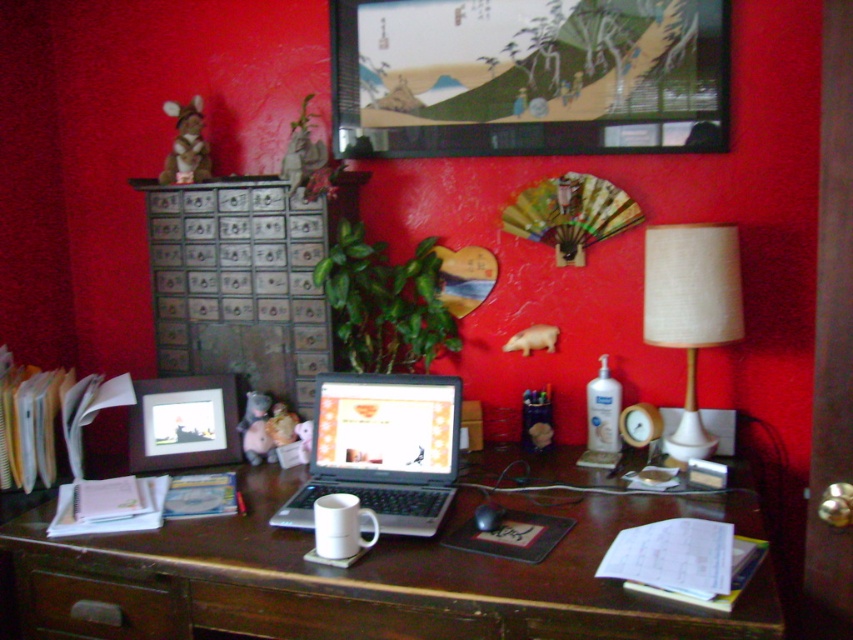
Consider the image. Is silver/black laptop at center to the right of brown wood drawer at lower left from the viewer's perspective?

Indeed, silver/black laptop at center is positioned on the right side of brown wood drawer at lower left.

Which is behind, point (419, 492) or point (33, 608)?

Positioned behind is point (419, 492).

Which is in front, point (444, 451) or point (97, 602)?

Point (97, 602) is more forward.

This screenshot has height=640, width=853. Identify the location of silver/black laptop at center. (381, 449).

Is the position of wooden desk at center more distant than that of wooden file cabinet at left?

No, wooden desk at center is closer to the viewer.

Can you confirm if wooden desk at center is positioned above wooden file cabinet at left?

No, wooden desk at center is not above wooden file cabinet at left.

Locate an element on the screen. wooden desk at center is located at coordinates (370, 577).

Is wooden desk at center smaller than matte black picture frame at center?

No.

Measure the distance between wooden desk at center and camera.

They are 3.73 feet apart.

The image size is (853, 640). Find the location of `wooden desk at center`. wooden desk at center is located at coordinates (370, 577).